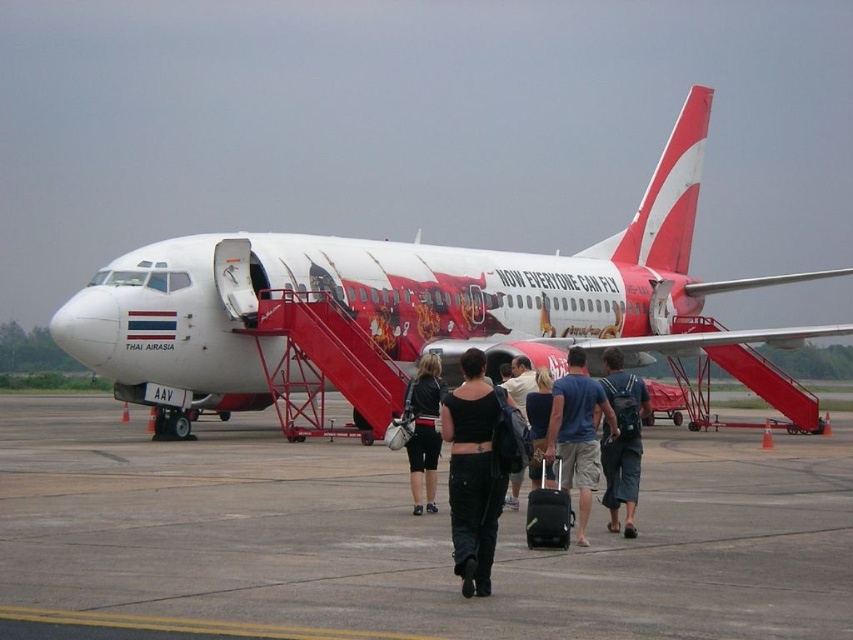
Does point (415, 376) come behind point (512, 476)?

Yes, it is behind point (512, 476).

Is point (427, 460) positioned in front of point (519, 371)?

Yes, point (427, 460) is closer to viewer.

This screenshot has width=853, height=640. Find the location of `leather jacket at center`. leather jacket at center is located at coordinates (422, 429).

You are a GUI agent. You are given a task and a screenshot of the screen. Output one action in this format:
    pyautogui.click(x=<x>, y=<y>)
    Task: Click on the concrete tarmac at center
    
    Given the screenshot: What is the action you would take?
    pyautogui.click(x=412, y=536)

Does concrete tarmac at center appear on the right side of dark blue jeans at center?

Indeed, concrete tarmac at center is positioned on the right side of dark blue jeans at center.

Does point (757, 611) come closer to viewer compared to point (532, 372)?

That is True.

The image size is (853, 640). Find the location of `concrete tarmac at center`. concrete tarmac at center is located at coordinates (412, 536).

From the picture: Is denim shorts at center to the left of black fabric suitcase at center from the viewer's perspective?

Incorrect, denim shorts at center is not on the left side of black fabric suitcase at center.

What do you see at coordinates (622, 440) in the screenshot? The image size is (853, 640). I see `denim shorts at center` at bounding box center [622, 440].

The width and height of the screenshot is (853, 640). I want to click on denim shorts at center, so click(622, 440).